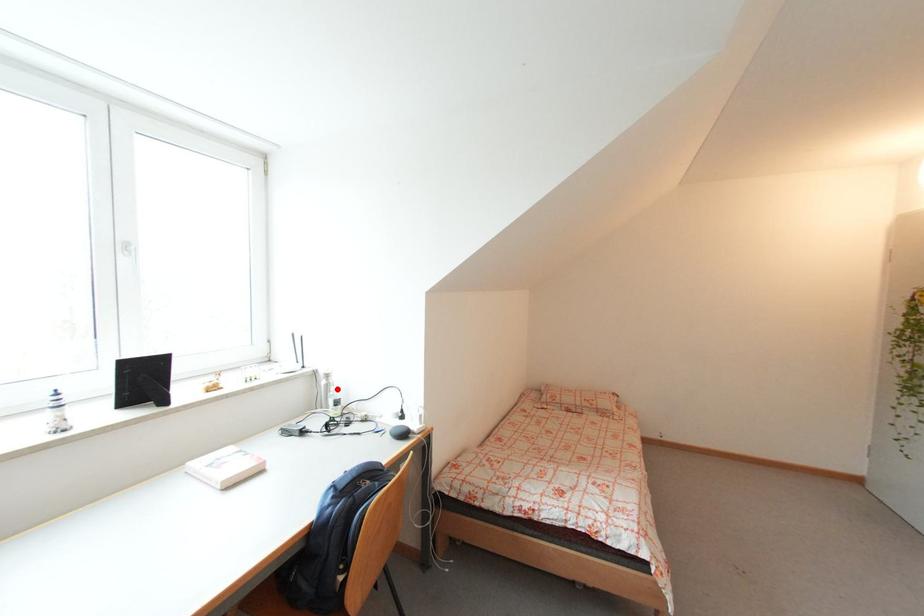
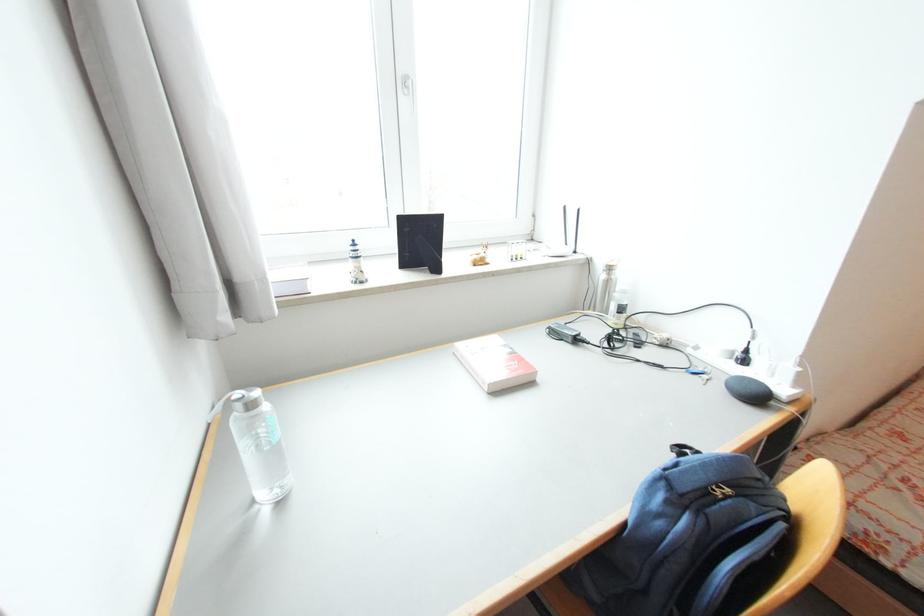
Where in the second image is the point corresponding to the highlighted location from the first image?

(623, 288)